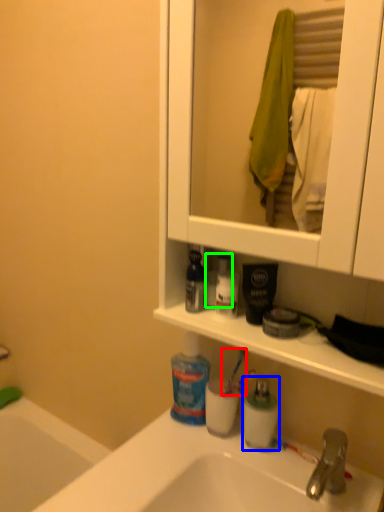
Question: Which object is the closest to the toothbrush (highlighted by a red box)? Choose among these: toiletry (highlighted by a blue box) or toiletry (highlighted by a green box).

Choices:
 (A) toiletry
 (B) toiletry

Answer: (A)